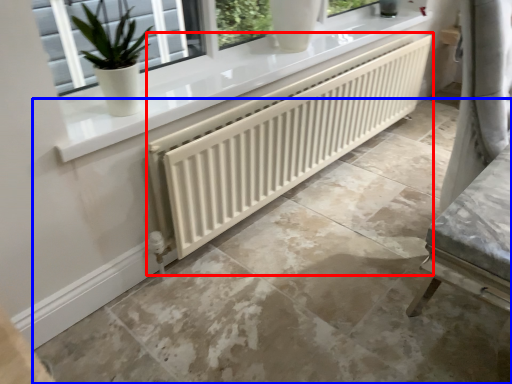
Question: Which object appears farthest to the camera in this image, radiator (highlighted by a red box) or concrete (highlighted by a blue box)?

Choices:
 (A) radiator
 (B) concrete

Answer: (A)